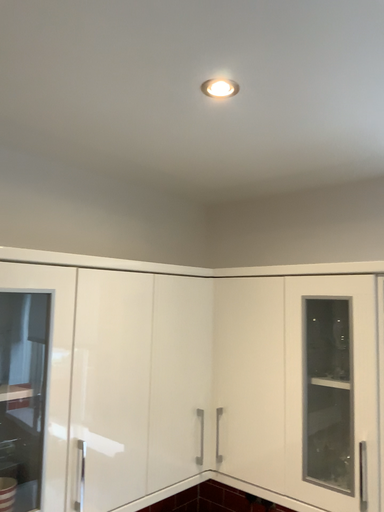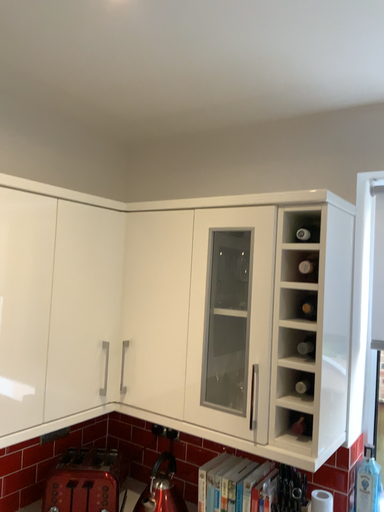
Question: Which way did the camera rotate in the video?

Choices:
 (A) rotated left
 (B) rotated right

Answer: (B)